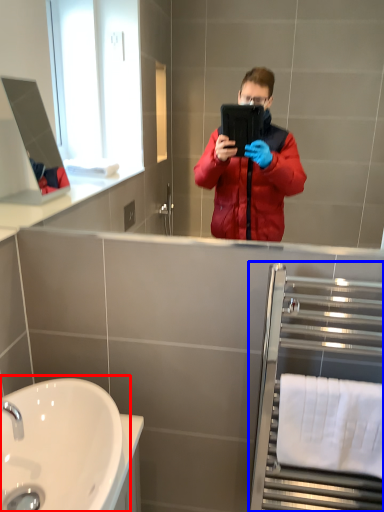
Question: Which object appears closest to the camera in this image, sink (highlighted by a red box) or balustrade (highlighted by a blue box)?

Choices:
 (A) sink
 (B) balustrade

Answer: (A)